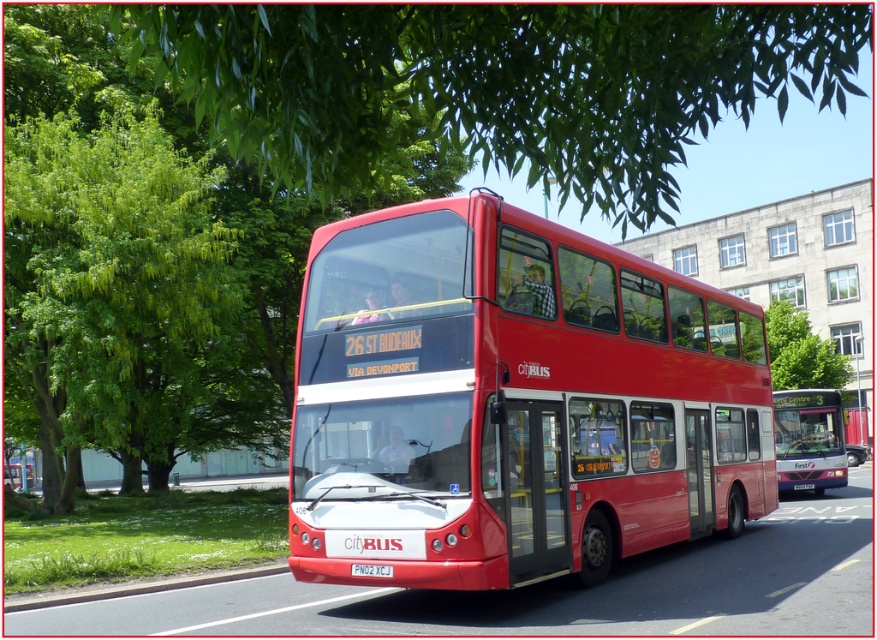
Question: Which of the following is the closest to the observer?

Choices:
 (A) (825, 465)
 (B) (275, 566)

Answer: (B)

Question: Which object appears farthest from the camera in this image?

Choices:
 (A) gray asphalt curb at lower left
 (B) shiny red bus at center

Answer: (A)

Question: Is matte red bus at center closer to the viewer compared to white plastic license plate at center?

Choices:
 (A) no
 (B) yes

Answer: (A)

Question: Which point appears closest to the camera in this image?

Choices:
 (A) [253, 568]
 (B) [19, 282]
 (C) [811, 403]

Answer: (A)

Question: Does gray asphalt curb at lower left appear on the left side of white plastic license plate at center?

Choices:
 (A) no
 (B) yes

Answer: (B)

Question: Is matte red bus at center below gray asphalt curb at lower left?

Choices:
 (A) no
 (B) yes

Answer: (A)